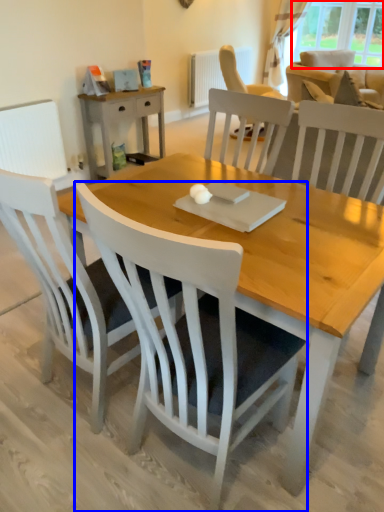
Question: Which point is further to the camera, window (highlighted by a red box) or chair (highlighted by a blue box)?

Choices:
 (A) window
 (B) chair

Answer: (A)